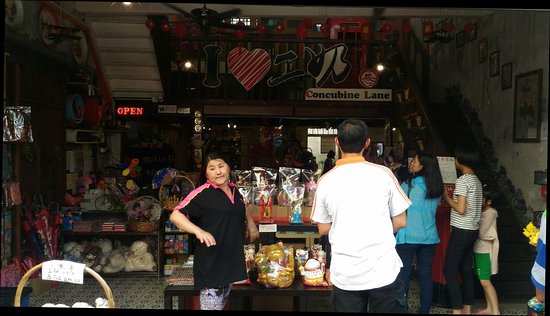
You are a GUI agent. You are given a task and a screenshot of the screen. Output one action in this format:
    pyautogui.click(x=<x>, y=<y>)
    Task: Click on the stairs
    
    Given the screenshot: What is the action you would take?
    pyautogui.click(x=96, y=104), pyautogui.click(x=9, y=233), pyautogui.click(x=442, y=131)